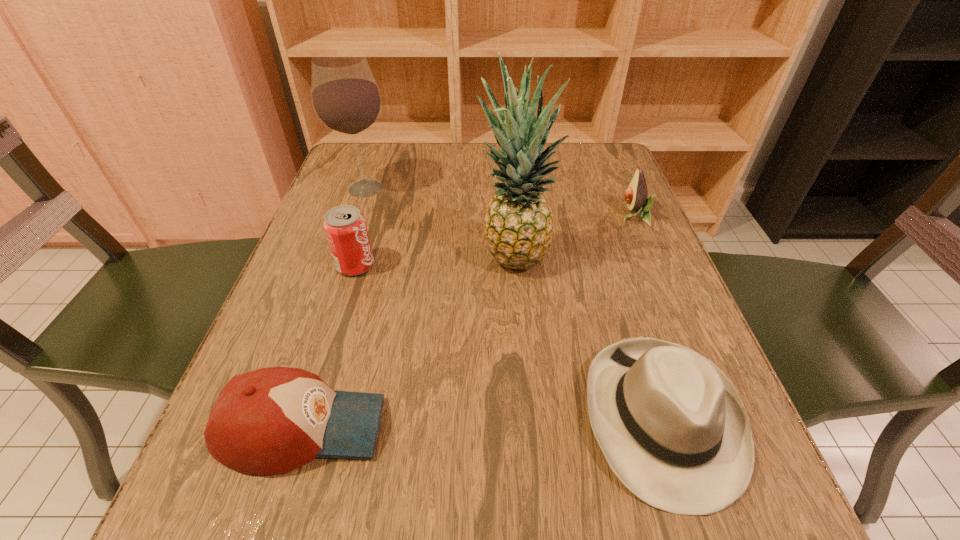
You are a GUI agent. You are given a task and a screenshot of the screen. Output one action in this format:
    pyautogui.click(x=<x>, y=<y>)
    Task: Click on the free space between the fifth shortest object and the baseball cap
    
    Given the screenshot: What is the action you would take?
    pyautogui.click(x=334, y=308)

Where is `vacant point located between the pineapple and the fedora`? This screenshot has height=540, width=960. vacant point located between the pineapple and the fedora is located at coordinates (588, 338).

Locate an element on the screen. Image resolution: width=960 pixels, height=540 pixels. vacant space that's between the fedora and the avocado is located at coordinates (648, 317).

Locate an element on the screen. This screenshot has height=540, width=960. vacant space that's between the soda can and the baseball cap is located at coordinates (329, 346).

Locate an element on the screen. free space between the fifth shortest object and the pineapple is located at coordinates (440, 223).

You are a GUI agent. You are given a task and a screenshot of the screen. Output one action in this format:
    pyautogui.click(x=<x>, y=<y>)
    Task: Click on the free area in between the pineapple and the alcohol
    The height and width of the screenshot is (540, 960).
    Given the screenshot: What is the action you would take?
    pyautogui.click(x=440, y=223)

Where is `unoccupied position between the third object from right to left and the avocado`? This screenshot has height=540, width=960. unoccupied position between the third object from right to left and the avocado is located at coordinates tap(573, 237).

Identify which object is the fifth closest to the soda can. Please provide its 2D coordinates. Your answer should be formatted as a tuple, i.e. [(x, y)], where the tuple contains the x and y coordinates of a point satisfying the conditions above.

[(636, 195)]

I want to click on object that is the second closest to the baseball cap, so click(x=518, y=226).

Find the location of `free space that satisfies the following two spatial constraints: 1. on the front side of the second tallest object; 2. on the left side of the soda can`. free space that satisfies the following two spatial constraints: 1. on the front side of the second tallest object; 2. on the left side of the soda can is located at coordinates (339, 265).